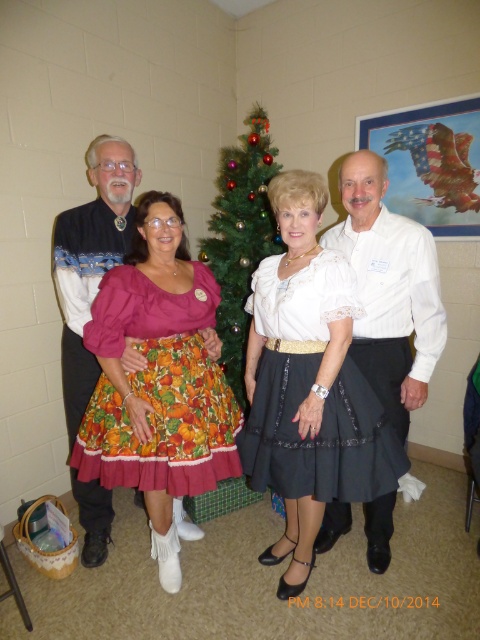
Is floral cotton skirt at center behind black satin dress at center?

No, floral cotton skirt at center is in front of black satin dress at center.

Does point (172, 477) come in front of point (316, 488)?

Yes.

Identify the location of floral cotton skirt at center. This screenshot has width=480, height=640. (158, 388).

Does floral cotton skirt at center have a lesser height compared to white striped shirt at center?

Correct, floral cotton skirt at center is not as tall as white striped shirt at center.

Who is higher up, floral cotton skirt at center or white striped shirt at center?

white striped shirt at center is above.

You are a GUI agent. You are given a task and a screenshot of the screen. Output one action in this format:
    pyautogui.click(x=<x>, y=<y>)
    Task: Click on the floral cotton skirt at center
    The height and width of the screenshot is (640, 480).
    Given the screenshot: What is the action you would take?
    pyautogui.click(x=158, y=388)

Locate an element on the screen. The height and width of the screenshot is (640, 480). floral cotton skirt at center is located at coordinates (158, 388).

Who is positioned more to the left, white striped shirt at center or matte black sweater at left?

matte black sweater at left

Which of these two, white striped shirt at center or matte black sweater at left, stands taller?

matte black sweater at left

This screenshot has height=640, width=480. Describe the element at coordinates (388, 289) in the screenshot. I see `white striped shirt at center` at that location.

Find the location of a particular element. The width and height of the screenshot is (480, 640). white striped shirt at center is located at coordinates (388, 289).